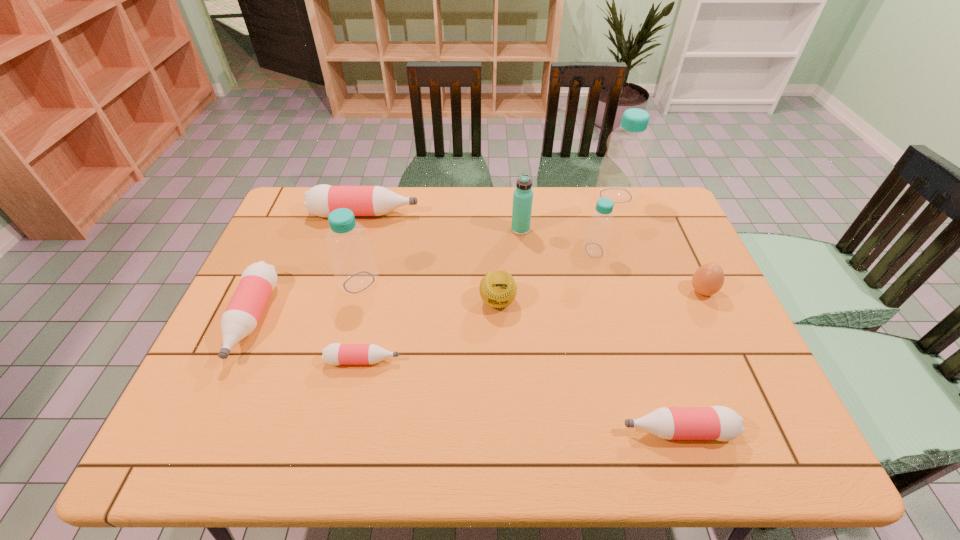
Locate which pink bottle is the second closest to the fifth tallest bottle. Please provide its 2D coordinates. Your answer should be formatted as a tuple, i.e. [(x, y)], where the tuple contains the x and y coordinates of a point satisfying the conditions above.

[(321, 200)]

Locate an element on the screen. vacant space that satisfies the following two spatial constraints: 1. with the cap open on the farthest pink bottle; 2. on the back side of the second tallest bottle is located at coordinates (345, 282).

Locate an element on the screen. The height and width of the screenshot is (540, 960). vacant space that satisfies the following two spatial constraints: 1. on the back side of the nearest blue bottle; 2. with the cap open on the farthest pink bottle is located at coordinates point(377,214).